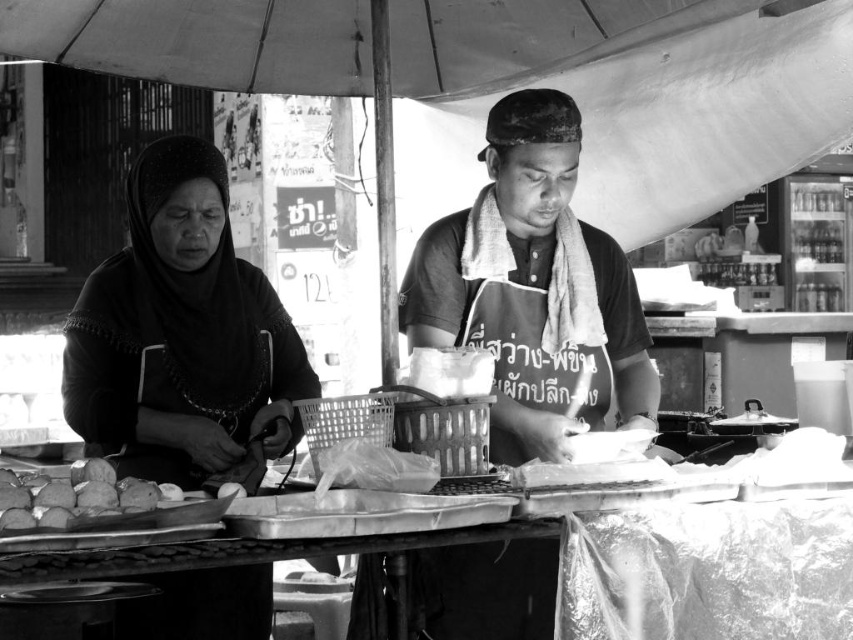
Based on the photo, between metallic tray at center and smooth brown bread at lower left, which one is positioned higher?

smooth brown bread at lower left

At what (x,y) coordinates should I click in order to perform the action: click on metallic tray at center. Please return your answer as a coordinate pair (x, y). The image size is (853, 640). Looking at the image, I should click on (708, 572).

The image size is (853, 640). What do you see at coordinates (181, 333) in the screenshot? I see `smooth black fabric at left` at bounding box center [181, 333].

Is point (140, 269) behind point (65, 483)?

Yes.

The height and width of the screenshot is (640, 853). I want to click on smooth black fabric at left, so click(x=181, y=333).

Does smooth black fabric at left have a lesser width compared to metallic tray at center?

Correct, smooth black fabric at left's width is less than metallic tray at center's.

Who is positioned more to the left, smooth black fabric at left or metallic tray at center?

From the viewer's perspective, smooth black fabric at left appears more on the left side.

Which is behind, point (155, 141) or point (599, 580)?

The point (155, 141) is more distant.

I want to click on smooth black fabric at left, so click(x=181, y=333).